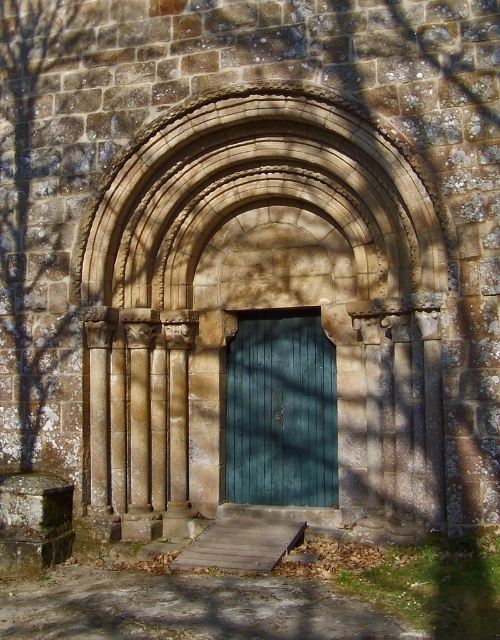
Question: Which point is farther from the camera taking this photo?

Choices:
 (A) (375, 154)
 (B) (279, 376)

Answer: (B)

Question: Is stone textured arch at center wider than teal wooden door at center?

Choices:
 (A) no
 (B) yes

Answer: (B)

Question: Which of the following is the farthest from the observer?

Choices:
 (A) teal wooden door at center
 (B) stone textured arch at center

Answer: (A)

Question: Which point is closer to the camera taking this photo?

Choices:
 (A) (361, 275)
 (B) (285, 490)

Answer: (A)

Question: Considering the relative positions of stone textured arch at center and teal wooden door at center in the image provided, where is stone textured arch at center located with respect to teal wooden door at center?

Choices:
 (A) left
 (B) right

Answer: (A)

Question: Where is stone textured arch at center located in relation to teal wooden door at center in the image?

Choices:
 (A) right
 (B) left

Answer: (B)